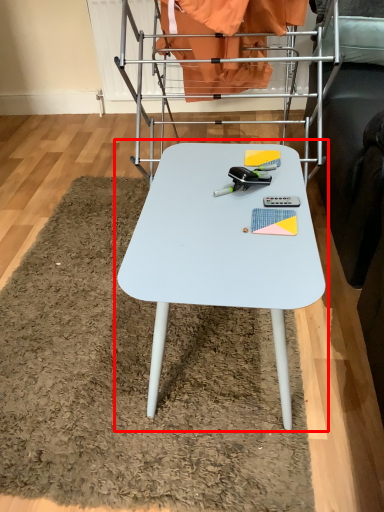
Question: Considering the relative positions of table (annotated by the red box) and bunk bed in the image provided, where is table (annotated by the red box) located with respect to the staircase?

Choices:
 (A) left
 (B) right

Answer: (A)